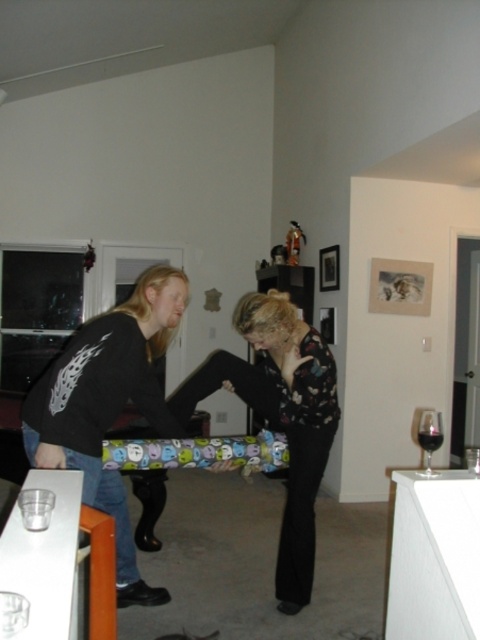
Question: Is matte black shirt at center positioned at the back of transparent glass at right?

Choices:
 (A) no
 (B) yes

Answer: (B)

Question: Which of the following is the closest to the observer?

Choices:
 (A) (33, 451)
 (B) (420, 433)
 (C) (422, 412)

Answer: (B)

Question: Which of the following is the farthest from the observer?

Choices:
 (A) transparent glass at right
 (B) matte black shirt at center

Answer: (B)

Question: Based on their relative distances, which object is nearer to the dark glass wine at lower right?

Choices:
 (A) matte black shirt at center
 (B) transparent glass at right

Answer: (B)

Question: Does matte black shirt at center have a greater width compared to transparent glass at right?

Choices:
 (A) yes
 (B) no

Answer: (A)

Question: Can you confirm if matte black shirt at center is wider than transparent glass at right?

Choices:
 (A) yes
 (B) no

Answer: (A)